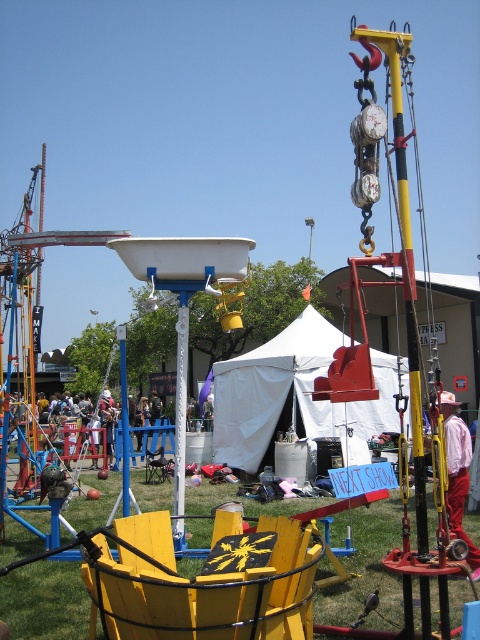
You are standing at the point with coordinates point (477, 552) and want to walk to the point with coordinates point (255, 355). Which direction should you move relative to the point you are currently at?

You should move forward because point (255, 355) is behind point (477, 552), meaning it is in the direction you are facing when standing at point (477, 552).

You are attending a fair and want to sit down. You see a yellow painted wood chair at lower center and a white cotton shirt at right. Which object is higher up from the ground?

The yellow painted wood chair at lower center is above the white cotton shirt at right, so the chair is higher up from the ground.